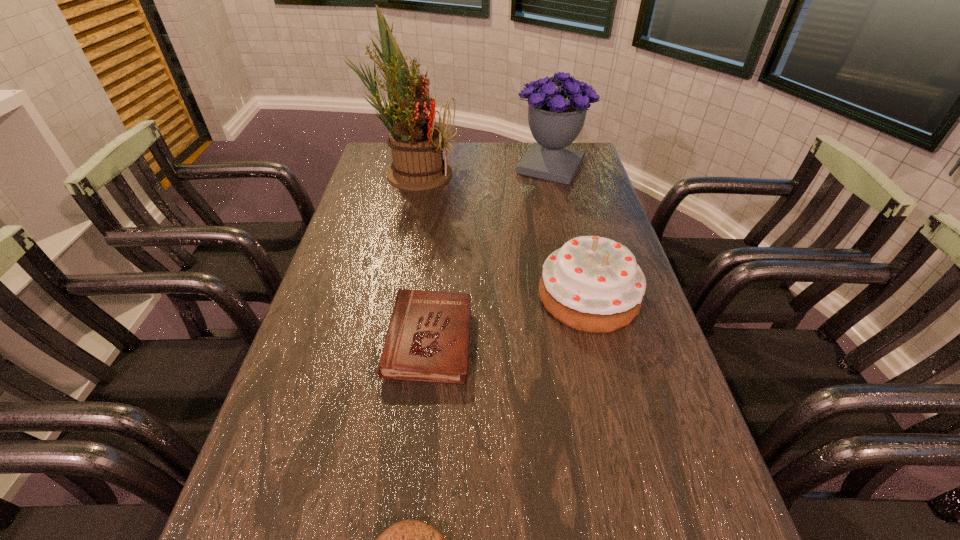
Locate an element on the screen. Image resolution: width=960 pixels, height=540 pixels. object located at the left edge is located at coordinates (417, 145).

The height and width of the screenshot is (540, 960). Find the location of `bouquet that is at the right edge`. bouquet that is at the right edge is located at coordinates (556, 117).

Identify the location of cake at the right edge. The height and width of the screenshot is (540, 960). (593, 284).

This screenshot has width=960, height=540. Find the location of `object present at the far left corner`. object present at the far left corner is located at coordinates (417, 145).

Find the location of a particular element. This screenshot has height=540, width=960. object that is at the far right corner is located at coordinates (556, 117).

The width and height of the screenshot is (960, 540). In the image, there is a desktop. In order to click on vacant space at the far edge in this screenshot , I will do `click(444, 151)`.

In the image, there is a desktop. What are the coordinates of `vacant space at the left edge` in the screenshot? It's located at (348, 265).

At what (x,y) coordinates should I click in order to perform the action: click on blank space at the right edge. Please return your answer as a coordinate pair (x, y). The image size is (960, 540). Looking at the image, I should click on (579, 186).

Where is `free location at the far left corner of the desktop`? This screenshot has height=540, width=960. free location at the far left corner of the desktop is located at coordinates (377, 160).

Where is `blank region between the bouquet and the second shortest object`? The image size is (960, 540). blank region between the bouquet and the second shortest object is located at coordinates (490, 254).